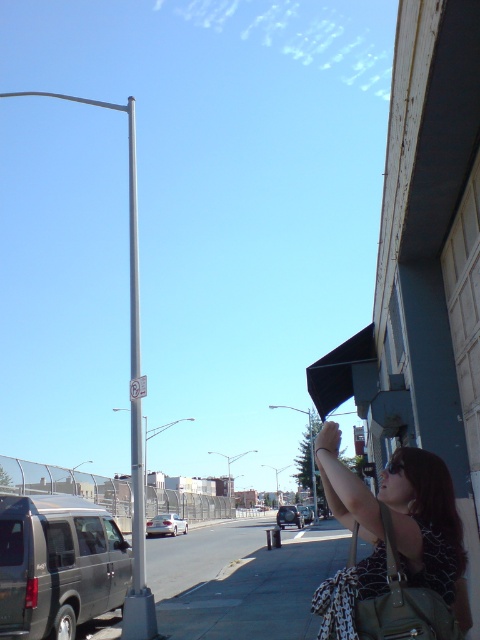
You are standing on the city street and want to walk from the point at coordinates point (x=211, y=612) to the point at coordinates point (x=136, y=429). Which direction should you face to walk towards your destination?

Since point (x=211, y=612) is behind point (x=136, y=429), you should face forward to walk towards your destination.

You are standing on the sidewalk and want to take a photo of the leopard print dress at lower right and the metallic silver sedan at center. Which object should you focus on first to ensure both are in the frame?

You should focus on the leopard print dress at lower right first since it is closer to the viewer, ensuring it stays in the frame while adjusting to include the metallic silver sedan at center.

You are standing on the gray concrete sidewalk at lower center. If you look directly ahead, what would you see in the scene?

The gray concrete sidewalk at lower center is located at point [259,588], so looking directly ahead would show the street lined with parked cars, including a dark SUV and silver sedan, as well as the person on the right near the building with a dark awning.